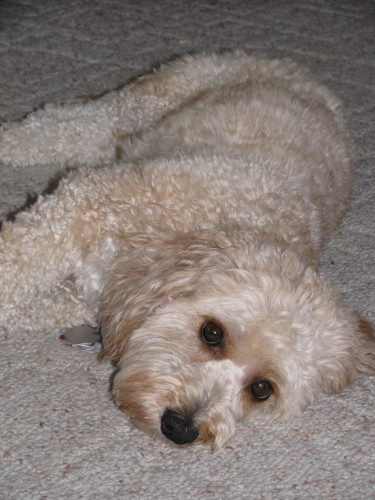
I want to click on carpet floor, so click(x=94, y=64).